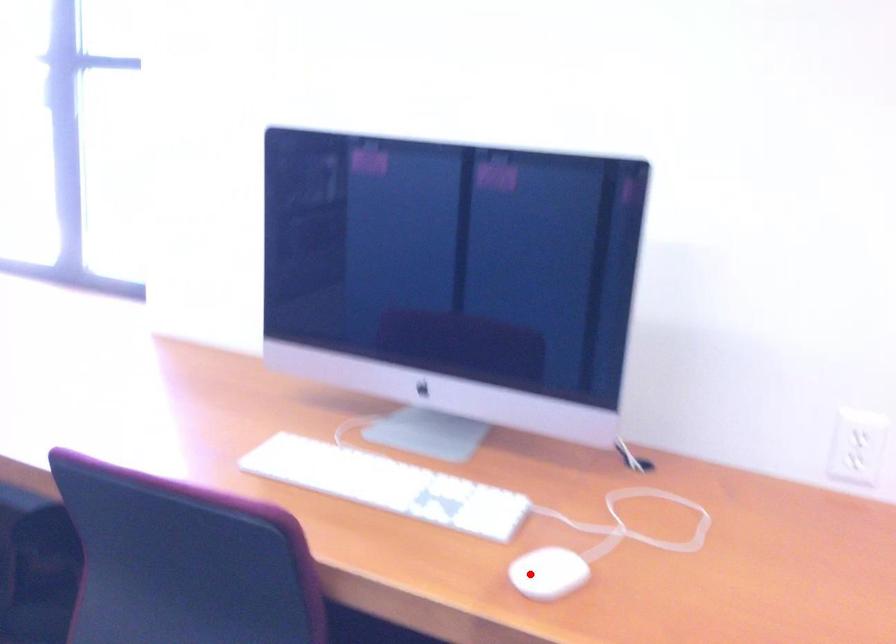
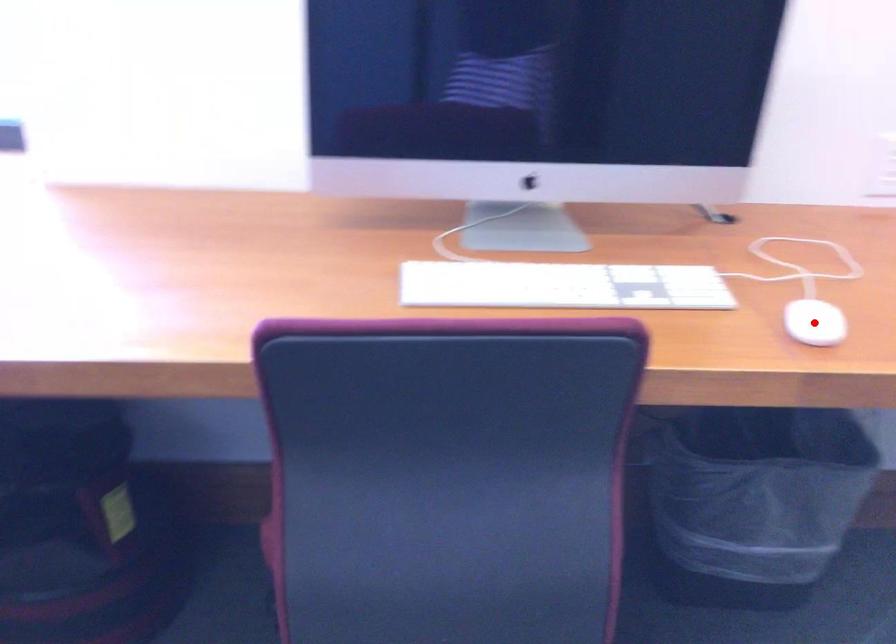
I am providing you with two images of the same scene from different viewpoints. A red point is marked on the first image and another point is marked on the second image. Does the point marked in image1 correspond to the same location as the one in image2?

Yes